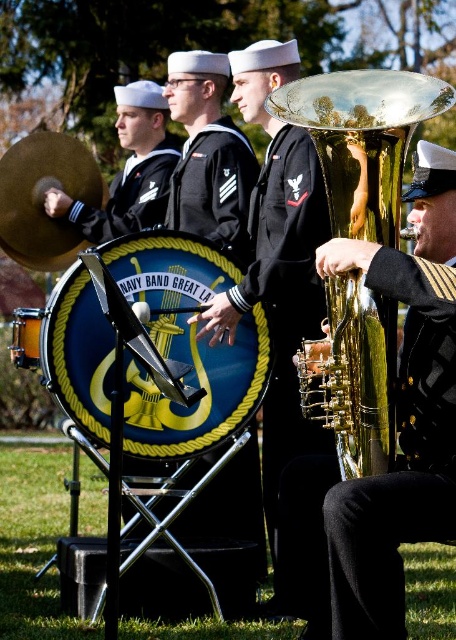
Question: Can you confirm if black fabric uniform at center is thinner than orange polished wood drum at center?

Choices:
 (A) yes
 (B) no

Answer: (B)

Question: Does blue glossy drum at center have a greater width compared to orange polished wood drum at center?

Choices:
 (A) yes
 (B) no

Answer: (A)

Question: Can you confirm if black fabric uniform at center is smaller than dark blue fabric sailor suit at center?

Choices:
 (A) yes
 (B) no

Answer: (A)

Question: Which object is the farthest from the gold shiny tuba at right?

Choices:
 (A) shiny black drum at center
 (B) dark blue fabric sailor suit at center

Answer: (B)

Question: Estimate the real-world distances between objects in this image. Which object is farther from the orange polished wood drum at center?

Choices:
 (A) black fabric uniform at center
 (B) dark blue fabric sailor suit at center

Answer: (A)

Question: Which point is farther from the camera taking this photo?

Choices:
 (A) (238, 166)
 (B) (151, 189)
 (C) (244, 348)

Answer: (B)